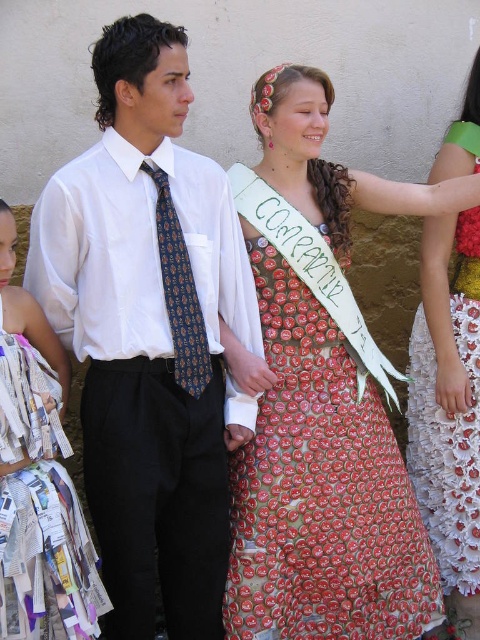
You are organizing a photo shoot and need to ensure that two key items are positioned correctly. The matte white shirt at center and the recycled paper dress at center must be placed within 15 inches of each other for the shot to look balanced. Based on the scene description, will their current positions meet this requirement?

The matte white shirt at center is 16.23 inches from the recycled paper dress at center. Since 16.23 inches is greater than the required 15 inches, their current positions do not meet the requirement for the photo shoot.

You are an event organizer looking at the image of the festive event. You need to arrange the printed fabric dress at center and the recycled paper dress at center on a display rack. According to the image, which dress should be placed higher on the rack?

The printed fabric dress at center should be placed higher on the rack since it is located above the recycled paper dress at center in the image.